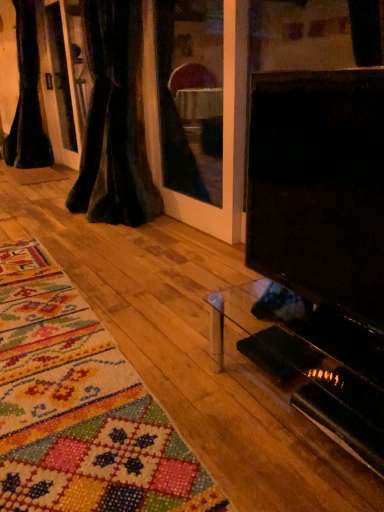
Question: Considering the relative positions of black velvet curtain at left, the second curtain positioned from the right, and black glossy tv at right in the image provided, is black velvet curtain at left, the second curtain positioned from the right, to the left of black glossy tv at right from the viewer's perspective?

Choices:
 (A) no
 (B) yes

Answer: (B)

Question: Is black velvet curtain at left, arranged as the first curtain when viewed from the back, next to black glossy tv at right?

Choices:
 (A) yes
 (B) no

Answer: (B)

Question: Is black velvet curtain at left, the first curtain viewed from the left, to the right of black glossy tv at right from the viewer's perspective?

Choices:
 (A) no
 (B) yes

Answer: (A)

Question: Does black velvet curtain at left, the second curtain positioned from the right, have a lesser width compared to black glossy tv at right?

Choices:
 (A) no
 (B) yes

Answer: (A)

Question: From a real-world perspective, is black velvet curtain at left, marked as the 2th curtain in a front-to-back arrangement, physically above black glossy tv at right?

Choices:
 (A) no
 (B) yes

Answer: (B)

Question: Considering the positions of black velvet curtain at left, marked as the 2th curtain in a front-to-back arrangement, and black glossy tv at right in the image, is black velvet curtain at left, marked as the 2th curtain in a front-to-back arrangement, taller or shorter than black glossy tv at right?

Choices:
 (A) short
 (B) tall

Answer: (B)

Question: From the image's perspective, is black velvet curtain at left, the first curtain viewed from the left, above or below black glossy tv at right?

Choices:
 (A) below
 (B) above

Answer: (B)

Question: From a real-world perspective, relative to black glossy tv at right, is black velvet curtain at left, the second curtain positioned from the right, vertically above or below?

Choices:
 (A) above
 (B) below

Answer: (A)

Question: Does point (21, 121) appear closer or farther from the camera than point (299, 144)?

Choices:
 (A) closer
 (B) farther

Answer: (B)

Question: From a real-world perspective, is black velvet curtain at left, the first curtain viewed from the left, physically located above or below velvet dark at left, which appears as the 1th curtain when viewed from the right?

Choices:
 (A) below
 (B) above

Answer: (B)

Question: Is black velvet curtain at left, arranged as the first curtain when viewed from the back, situated inside velvet dark at left, arranged as the 2th curtain when viewed from the left, or outside?

Choices:
 (A) inside
 (B) outside

Answer: (B)

Question: Is black velvet curtain at left, arranged as the first curtain when viewed from the back, wider or thinner than velvet dark at left, which appears as the 1th curtain when viewed from the right?

Choices:
 (A) wide
 (B) thin

Answer: (A)

Question: In the image, is black velvet curtain at left, the second curtain positioned from the right, positioned in front of or behind velvet dark at left, which is the 2th curtain in back-to-front order?

Choices:
 (A) front
 (B) behind

Answer: (B)

Question: Is point (301, 287) closer or farther from the camera than point (46, 151)?

Choices:
 (A) closer
 (B) farther

Answer: (A)

Question: Is black glossy tv at right to the left or to the right of black velvet curtain at left, the first curtain viewed from the left, in the image?

Choices:
 (A) right
 (B) left

Answer: (A)